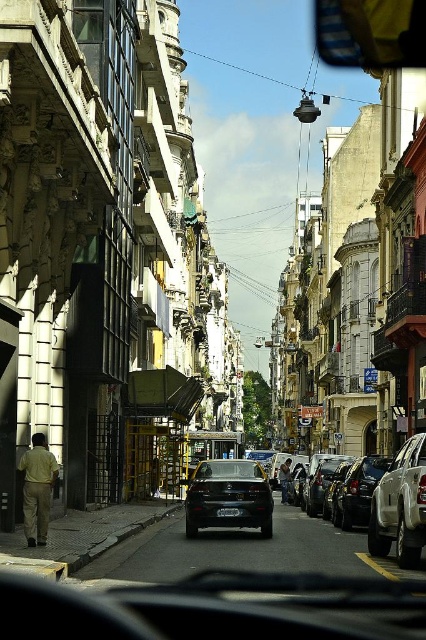
You are driving down this narrow street and need to park your car. There are two parking spots marked by points on the road ahead. The first is at point (258,524) and the second at point (236,515). Which parking spot is closer to your current position?

Point (258,524) is closer to the viewer than point (236,515), so the parking spot at point (258,524) is closer to your current position.

You are sitting in a car on the bustling urban street scene. You notice two points marked on the road ahead of you. The first point is at coordinates point [414,490] and the second is at point [227,509]. Which point is closer to your current position?

Point [414,490] is closer to the camera than point [227,509], so the first point is closer to your current position.

You are driving a car and see the point marked at coordinates (x=400, y=506) in the image. What object is located at that point?

The point at coordinates (x=400, y=506) indicates a white matte car at the right.